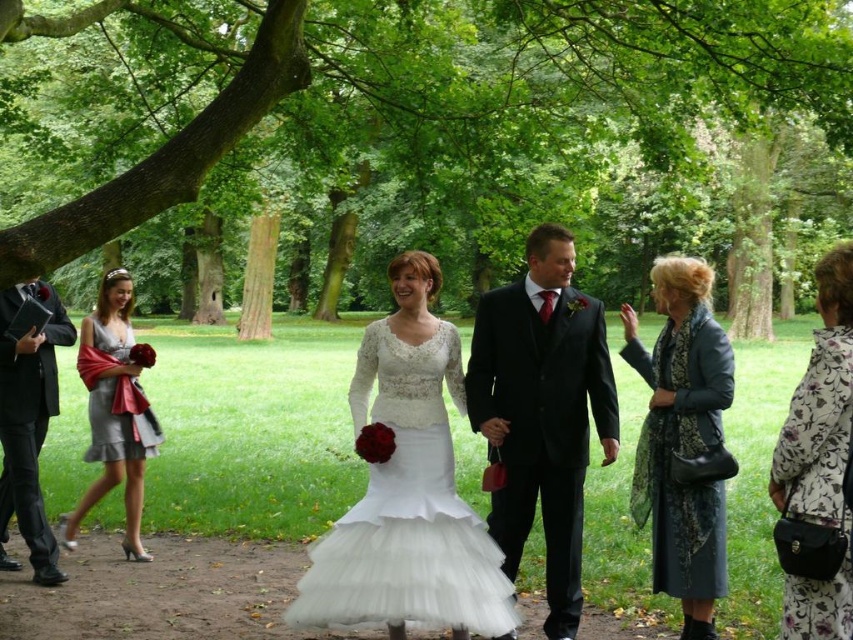
You are standing at the point marked by the coordinate point at point (426, 141). Looking around, you see a green leafy tree at upper center. Which direction should you face to look towards the green leafy tree at upper center?

The point at (426, 141) corresponds to the green leafy tree at upper center, so facing towards it would mean looking directly ahead or upwards since it is at the upper center position.

You are a photographer at the wedding. You want to take a photo of the green leafy tree at upper center and the matte black jacket at left. Which object is positioned closer to the camera?

The green leafy tree at upper center is closer to the viewer than the matte black jacket at left, so it will appear closer to the camera in the photo.